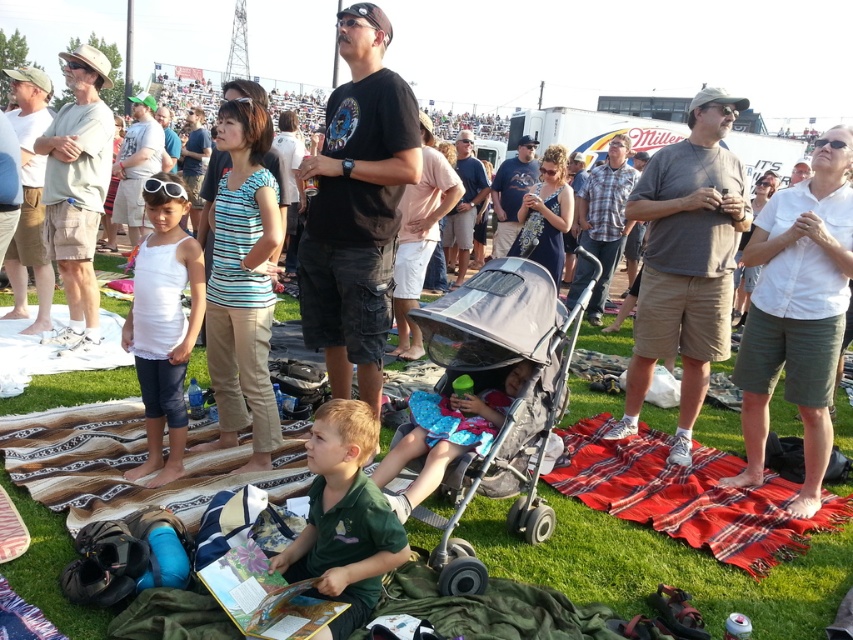
You are a photographer at the event and want to capture a photo of the plaid cotton shirt at center and the white shirt at center. Which shirt should you focus on first if you want to include both in the frame without moving the camera?

You should focus on the plaid cotton shirt at center first because it is shorter than the white shirt at center, allowing you to frame both shirts within the camera view without needing to adjust the camera position.